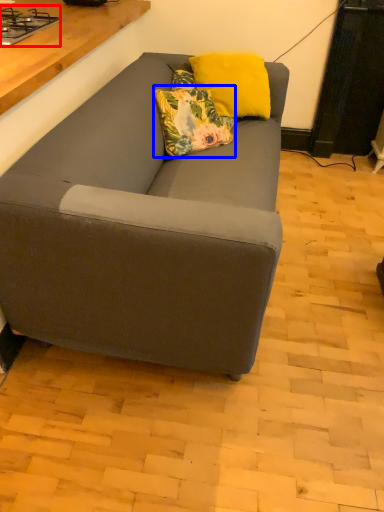
Question: Which point is further to the camera, gas stove (highlighted by a red box) or pillow (highlighted by a blue box)?

Choices:
 (A) gas stove
 (B) pillow

Answer: (B)